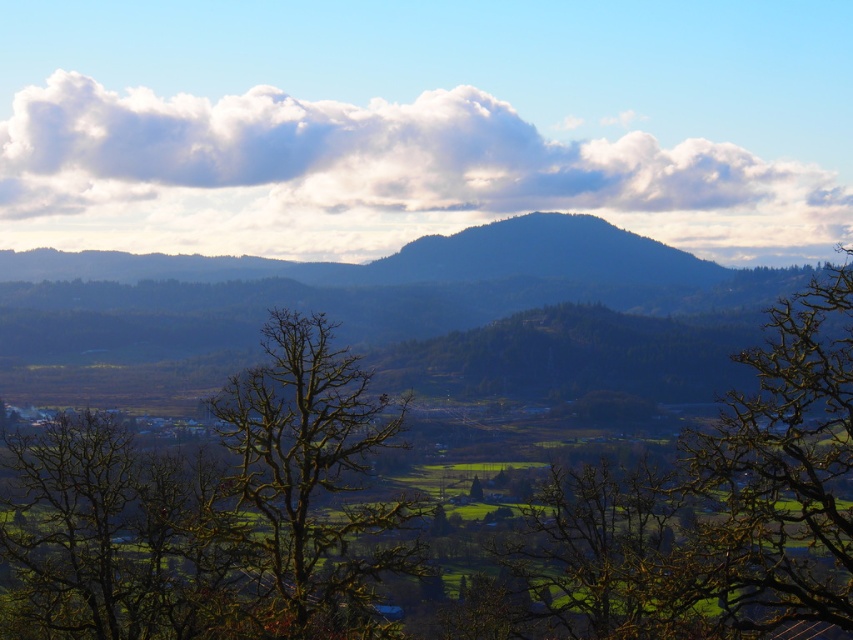
Question: Can you confirm if green leafy tree at center is positioned below green matte tree at center?

Choices:
 (A) no
 (B) yes

Answer: (A)

Question: Which object is closer to the camera taking this photo?

Choices:
 (A) bare branches at center
 (B) green matte tree at center
 (C) green leafy tree at center

Answer: (C)

Question: Which of the following is the farthest from the observer?

Choices:
 (A) green matte tree at center
 (B) cloudy sky at upper center
 (C) green leafy tree at center

Answer: (B)

Question: Which point is farther to the camera?

Choices:
 (A) (186, 221)
 (B) (473, 481)
 (C) (331, 486)
 (D) (64, 545)

Answer: (A)

Question: Is cloudy sky at upper center thinner than bare branches at center?

Choices:
 (A) yes
 (B) no

Answer: (B)

Question: Can you confirm if bare branches at center is positioned above green matte tree at center?

Choices:
 (A) no
 (B) yes

Answer: (B)